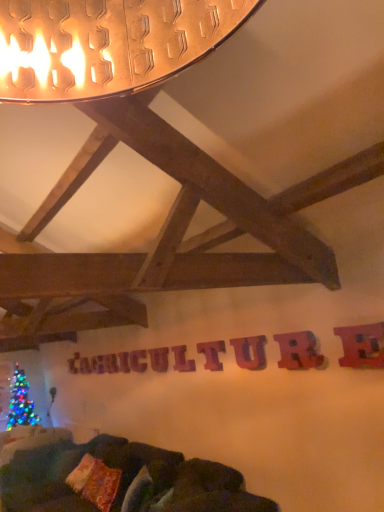
Question: Is velvet dark green couch at lower center far away from purple wood letter at center, placed as the 7th letter when sorted from left to right?

Choices:
 (A) yes
 (B) no

Answer: (A)

Question: Is the depth of velvet dark green couch at lower center less than that of purple wood letter at center, placed as the 7th letter when sorted from left to right?

Choices:
 (A) no
 (B) yes

Answer: (B)

Question: From the image's perspective, is velvet dark green couch at lower center above purple wood letter at center, placed as the 7th letter when sorted from left to right?

Choices:
 (A) no
 (B) yes

Answer: (A)

Question: Considering the relative sizes of velvet dark green couch at lower center and purple wood letter at center, positioned as the 3th letter in right-to-left order, in the image provided, is velvet dark green couch at lower center thinner than purple wood letter at center, positioned as the 3th letter in right-to-left order,?

Choices:
 (A) no
 (B) yes

Answer: (A)

Question: Is velvet dark green couch at lower center bigger than purple wood letter at center, positioned as the 3th letter in right-to-left order?

Choices:
 (A) no
 (B) yes

Answer: (B)

Question: Is velvet dark green couch at lower center looking in the opposite direction of purple wood letter at center, the 7th letter when ordered from back to front?

Choices:
 (A) yes
 (B) no

Answer: (B)

Question: Is the position of velvet dark green couch at lower center less distant than that of wooden letter at center, which is the 5th letter from right to left?

Choices:
 (A) no
 (B) yes

Answer: (B)

Question: Considering the relative sizes of velvet dark green couch at lower center and wooden letter at center, which is the fifth letter in back-to-front order, in the image provided, is velvet dark green couch at lower center taller than wooden letter at center, which is the fifth letter in back-to-front order,?

Choices:
 (A) yes
 (B) no

Answer: (A)

Question: Is velvet dark green couch at lower center completely or partially outside of wooden letter at center, which is the fifth letter in back-to-front order?

Choices:
 (A) no
 (B) yes

Answer: (B)

Question: Is wooden letter at center, which is the 5th letter from right to left, at the back of velvet dark green couch at lower center?

Choices:
 (A) yes
 (B) no

Answer: (B)

Question: Does velvet dark green couch at lower center appear on the right side of wooden letter at center, the 5th letter in the front-to-back sequence?

Choices:
 (A) no
 (B) yes

Answer: (A)

Question: From the image's perspective, is velvet dark green couch at lower center below wooden letter at center, which is the 5th letter from right to left?

Choices:
 (A) no
 (B) yes

Answer: (B)

Question: Considering the relative sizes of velvet dark green couch at lower center and wooden letter at center, which is the eighth letter in left-to-right order, in the image provided, is velvet dark green couch at lower center smaller than wooden letter at center, which is the eighth letter in left-to-right order,?

Choices:
 (A) no
 (B) yes

Answer: (A)